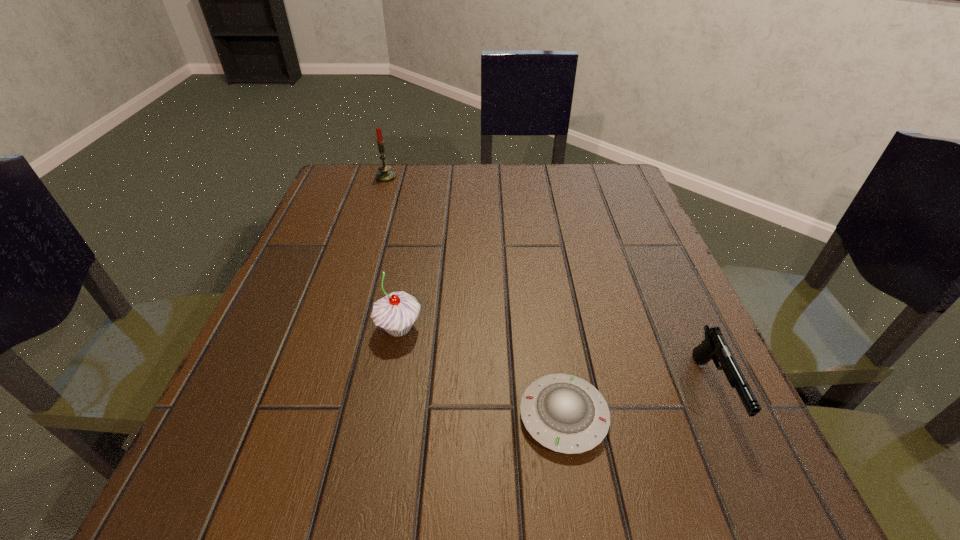
The height and width of the screenshot is (540, 960). What are the coordinates of `candle` in the screenshot? It's located at (385, 175).

What are the coordinates of `the farthest object` in the screenshot? It's located at (385, 175).

This screenshot has width=960, height=540. In order to click on the second object from left to right in this screenshot , I will do `click(395, 313)`.

Where is `the second farthest object`? the second farthest object is located at coordinates (395, 313).

At what (x,y) coordinates should I click in order to perform the action: click on the rightmost object. Please return your answer as a coordinate pair (x, y). The height and width of the screenshot is (540, 960). Looking at the image, I should click on (714, 347).

Find the location of a particular element. The width and height of the screenshot is (960, 540). the third tallest object is located at coordinates point(714,347).

Where is `the third object from left to right`? the third object from left to right is located at coordinates (564, 413).

Find the location of `saucer`. saucer is located at coordinates (564, 413).

This screenshot has width=960, height=540. In order to click on free space located on the front of the candle in this screenshot , I will do `click(361, 257)`.

Locate an element on the screen. free space located on the left of the third nearest object is located at coordinates (304, 329).